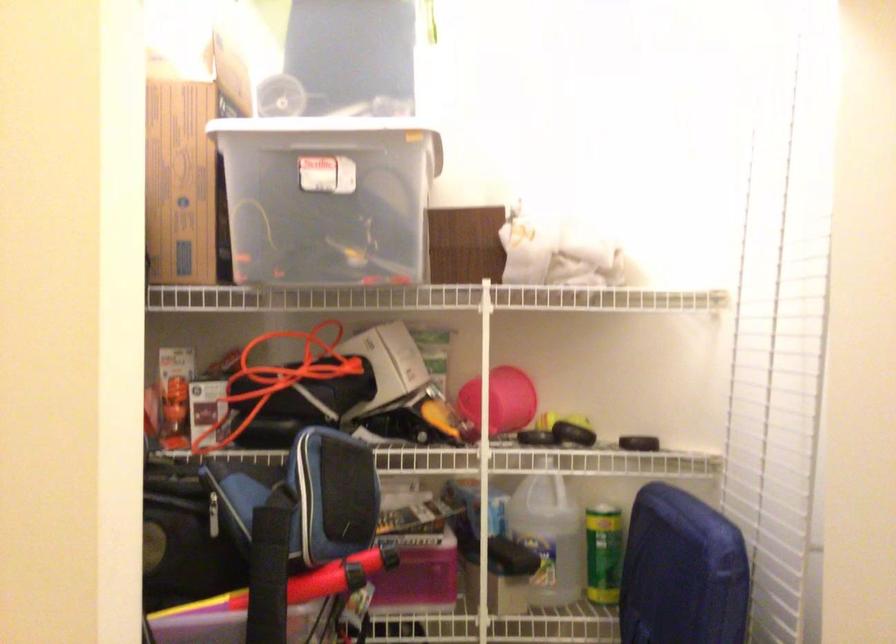
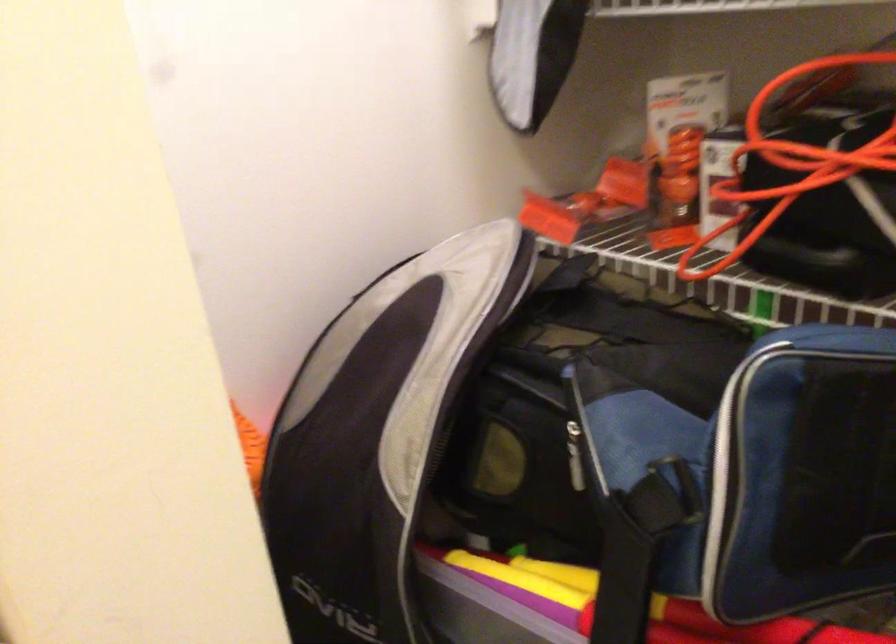
In the second image, find the point that corresponds to (171,397) in the first image.

(681, 164)